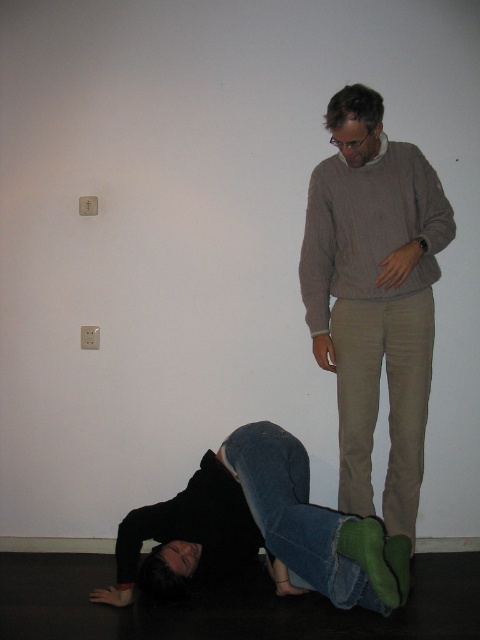
Who is shorter, cable-knit sweater at center or jeans at lower center?

jeans at lower center

Does cable-knit sweater at center appear on the left side of jeans at lower center?

In fact, cable-knit sweater at center is to the right of jeans at lower center.

Where is `cable-knit sweater at center`? Image resolution: width=480 pixels, height=640 pixels. cable-knit sweater at center is located at coordinates (370, 227).

Can you confirm if light brown sweater at center is smaller than cable-knit sweater at center?

No, light brown sweater at center is not smaller than cable-knit sweater at center.

Is light brown sweater at center further to camera compared to cable-knit sweater at center?

No, light brown sweater at center is in front of cable-knit sweater at center.

Is point (424, 365) closer to viewer compared to point (352, 224)?

No, it is not.

At what (x,y) coordinates should I click in order to perform the action: click on light brown sweater at center. Please return your answer as a coordinate pair (x, y). Looking at the image, I should click on (374, 296).

Does light brown sweater at center have a lesser height compared to jeans at lower center?

No.

Is light brown sweater at center bigger than jeans at lower center?

Correct, light brown sweater at center is larger in size than jeans at lower center.

Where is `light brown sweater at center`? The image size is (480, 640). light brown sweater at center is located at coordinates (374, 296).